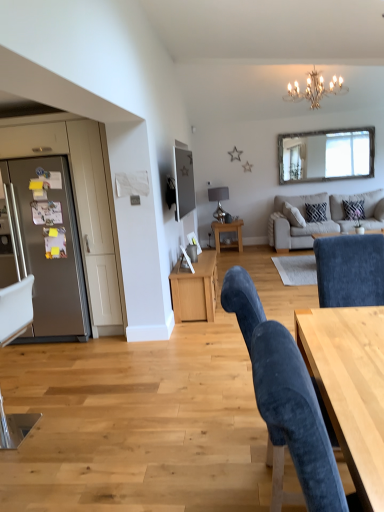
What do you see at coordinates (326, 155) in the screenshot? The image size is (384, 512). I see `clear glass mirror at upper center` at bounding box center [326, 155].

In order to face gold metallic chandelier at upper center, the second lamp in the left-to-right sequence, should I rotate leftwards or rightwards?

Turn right approximately 16.024 degrees to face it.

What are the coordinates of `satin silver refrigerator at left` in the screenshot? It's located at (50, 251).

What is the approximate width of patterned fabric pillow at center right, positioned as the first pillow in left-to-right order?

patterned fabric pillow at center right, positioned as the first pillow in left-to-right order, is 8.69 inches in width.

What do you see at coordinates (316, 212) in the screenshot? This screenshot has height=512, width=384. I see `patterned fabric pillow at center right, positioned as the first pillow in left-to-right order` at bounding box center [316, 212].

The height and width of the screenshot is (512, 384). In order to click on metallic silver chair at left, the first chair when ordered from left to right in this screenshot , I will do `click(15, 309)`.

This screenshot has width=384, height=512. I want to click on clear glass mirror at upper center, so click(x=326, y=155).

Which object is closer to the camera, beige fabric couch at upper right or velvet blue chair at lower right, which is the second chair from back to front?

velvet blue chair at lower right, which is the second chair from back to front.

Considering the positions of points (310, 246) and (280, 348), is point (310, 246) closer to camera compared to point (280, 348)?

No, (310, 246) is further to viewer.

Which of these two, beige fabric couch at upper right or velvet blue chair at lower right, which is the second chair from left to right, is wider?

beige fabric couch at upper right is wider.

From the image's perspective, which chair is the 1st one below the beige fabric couch at upper right? Please provide its 2D coordinates.

[(285, 401)]

Which of these two, patterned fabric pillow at center right, positioned as the first pillow in left-to-right order, or velvet blue chair at lower right, which ranks as the first chair in right-to-left order, stands taller?

With more height is velvet blue chair at lower right, which ranks as the first chair in right-to-left order.

Choose the correct answer: Is patterned fabric pillow at center right, the 2th pillow viewed from the right, inside velvet blue chair at lower right, which is the 1th chair in front-to-back order, or outside it?

patterned fabric pillow at center right, the 2th pillow viewed from the right, cannot be found inside velvet blue chair at lower right, which is the 1th chair in front-to-back order.

Could you tell me if patterned fabric pillow at center right, the 2th pillow viewed from the right, is turned towards velvet blue chair at lower right, which ranks as the first chair in right-to-left order?

Yes, patterned fabric pillow at center right, the 2th pillow viewed from the right, is aimed at velvet blue chair at lower right, which ranks as the first chair in right-to-left order.

From a real-world perspective, which object stands above the other?

In real-world perspective, patterned fabric pillow at center right, positioned as the first pillow in left-to-right order, is above.

From a real-world perspective, which is physically above, metallic silver chair at left, the first chair when ordered from left to right, or satin silver refrigerator at left?

From a 3D spatial view, satin silver refrigerator at left is above.

Is metallic silver chair at left, the 1th chair from the back, further to camera compared to satin silver refrigerator at left?

No, the depth of metallic silver chair at left, the 1th chair from the back, is less than that of satin silver refrigerator at left.

How different are the orientations of metallic silver chair at left, the second chair when ordered from front to back, and satin silver refrigerator at left in degrees?

91.8 degrees.

From the image's perspective, which one is positioned higher, metallic silver chair at left, the 2th chair in the right-to-left sequence, or satin silver refrigerator at left?

From the image's view, satin silver refrigerator at left is above.

At what (x,y) coordinates should I click in order to perform the action: click on lamp that is the 1st one when counting upward from the velvet blue chair at lower right, which is the second chair from left to right (from the image's perspective). Please return your answer as a coordinate pair (x, y). Looking at the image, I should click on (219, 201).

Based on their sizes in the image, would you say velvet blue chair at lower right, which is the 1th chair in front-to-back order, is bigger or smaller than matte silver lampshade at center, the 1th lamp when ordered from bottom to top?

velvet blue chair at lower right, which is the 1th chair in front-to-back order, is bigger than matte silver lampshade at center, the 1th lamp when ordered from bottom to top.

From a real-world perspective, which is physically below, velvet blue chair at lower right, which is the second chair from back to front, or matte silver lampshade at center, which is the 1th lamp in back-to-front order?

velvet blue chair at lower right, which is the second chair from back to front, from a real-world perspective.

Is velvet blue chair at lower right, which is the 1th chair in front-to-back order, aimed at matte silver lampshade at center, which is the 1th lamp in back-to-front order?

No, velvet blue chair at lower right, which is the 1th chair in front-to-back order, is not facing towards matte silver lampshade at center, which is the 1th lamp in back-to-front order.

Find the location of `mirror that appears above the matte silver lampshade at center, which is the 1th lamp in back-to-front order (from a real-world perspective)`. mirror that appears above the matte silver lampshade at center, which is the 1th lamp in back-to-front order (from a real-world perspective) is located at coordinates (x=326, y=155).

Is clear glass mirror at upper center turned away from matte silver lampshade at center, the 1th lamp when ordered from left to right?

No, matte silver lampshade at center, the 1th lamp when ordered from left to right, is not at the back of clear glass mirror at upper center.

From the image's perspective, does clear glass mirror at upper center appear lower than matte silver lampshade at center, the 1th lamp when ordered from bottom to top?

No, from the image's perspective, clear glass mirror at upper center is not below matte silver lampshade at center, the 1th lamp when ordered from bottom to top.

Does point (219, 211) lie in front of point (368, 425)?

No, (219, 211) is behind (368, 425).

Is the surface of matte silver lampshade at center, the 1th lamp when ordered from left to right, in direct contact with light wood desk at lower right?

No, matte silver lampshade at center, the 1th lamp when ordered from left to right, is not touching light wood desk at lower right.

From the image's perspective, which one is positioned higher, matte black tv at upper center or satin silver refrigerator at left?

matte black tv at upper center appears higher in the image.

From a real-world perspective, is matte black tv at upper center above or below satin silver refrigerator at left?

From a real-world perspective, matte black tv at upper center is physically above satin silver refrigerator at left.

How distant is matte black tv at upper center from satin silver refrigerator at left?

matte black tv at upper center is 5.17 feet away from satin silver refrigerator at left.

Which is farther, (178, 185) or (22, 189)?

The point (178, 185) is farther.

Find the location of `studio couch behind the velvet blue chair at lower right, which is the second chair from left to right`. studio couch behind the velvet blue chair at lower right, which is the second chair from left to right is located at coordinates [x=319, y=222].

Which pillow is the 1st one when counting from the right side of the velvet blue chair at lower right, which ranks as the first chair in right-to-left order? Please provide its 2D coordinates.

[(316, 212)]

From the image, which object appears to be farther from wooden side table at center, metallic silver chair at left, the 1th chair from the back, or patterned fabric pillow at center right, the 2th pillow viewed from the right?

Based on the image, metallic silver chair at left, the 1th chair from the back, appears to be further to wooden side table at center.

Looking at the image, which one is located closer to clear glass mirror at upper center, patterned fabric pillow at center right, the 2th pillow viewed from the right, or beige fabric couch at upper right?

Among the two, beige fabric couch at upper right is located nearer to clear glass mirror at upper center.

Considering their positions, is patterned fabric pillow at center right, positioned as the first pillow in left-to-right order, positioned closer to matte silver lampshade at center, the 1th lamp when ordered from left to right, than light wood desk at lower right?

patterned fabric pillow at center right, positioned as the first pillow in left-to-right order, is closer to matte silver lampshade at center, the 1th lamp when ordered from left to right.

Based on their spatial positions, is clear glass mirror at upper center or metallic silver chair at left, the 2th chair in the right-to-left sequence, further from zebra-patterned fabric pillow at upper right, the 2th pillow in the left-to-right sequence?

The object further to zebra-patterned fabric pillow at upper right, the 2th pillow in the left-to-right sequence, is metallic silver chair at left, the 2th chair in the right-to-left sequence.

When comparing their distances from beige fabric couch at upper right, does clear glass mirror at upper center or gold metallic chandelier at upper center, arranged as the 1th lamp when viewed from the right, seem closer?

clear glass mirror at upper center lies closer to beige fabric couch at upper right than the other object.

Considering their positions, is light wood desk at lower right positioned closer to metallic silver chair at left, the 2th chair in the right-to-left sequence, than zebra-patterned fabric pillow at upper right, the 2th pillow in the left-to-right sequence?

light wood desk at lower right is closer to metallic silver chair at left, the 2th chair in the right-to-left sequence.

Considering their positions, is metallic silver chair at left, the 2th chair in the right-to-left sequence, positioned further to satin silver refrigerator at left than zebra-patterned fabric pillow at upper right, the 2th pillow in the left-to-right sequence?

zebra-patterned fabric pillow at upper right, the 2th pillow in the left-to-right sequence, lies further to satin silver refrigerator at left than the other object.

From the image, which object appears to be farther from beige fabric couch at upper right, clear glass mirror at upper center or light wood desk at lower right?

light wood desk at lower right is positioned further to the anchor beige fabric couch at upper right.

Where is `lamp between metallic silver chair at left, the 2th chair in the right-to-left sequence, and zebra-patterned fabric pillow at upper right, the first pillow when ordered from right to left, in the front-back direction`? lamp between metallic silver chair at left, the 2th chair in the right-to-left sequence, and zebra-patterned fabric pillow at upper right, the first pillow when ordered from right to left, in the front-back direction is located at coordinates (315, 89).

This screenshot has width=384, height=512. What are the coordinates of `fridge between metallic silver chair at left, the 1th chair from the back, and matte silver lampshade at center, the 1th lamp when ordered from bottom to top, in the front-back direction` in the screenshot? It's located at (50, 251).

Image resolution: width=384 pixels, height=512 pixels. I want to click on pillow between gold metallic chandelier at upper center, which is counted as the second lamp, starting from the bottom, and patterned fabric pillow at center right, the 2th pillow viewed from the right, from front to back, so click(x=354, y=209).

You are a GUI agent. You are given a task and a screenshot of the screen. Output one action in this format:
    pyautogui.click(x=<x>, y=<y>)
    Task: Click on the lamp between satin silver refrigerator at left and matte silver lampshade at center, placed as the 2th lamp when sorted from right to left, along the z-axis
    
    Given the screenshot: What is the action you would take?
    pyautogui.click(x=315, y=89)